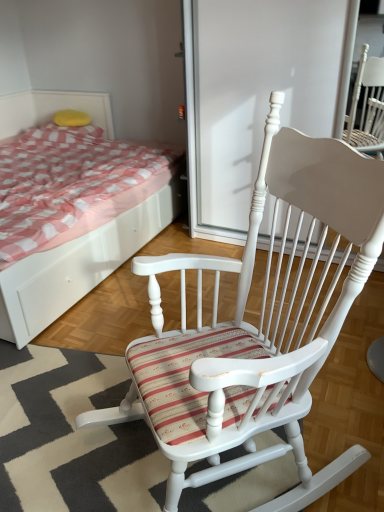
Question: Is white wood rocking chair at center shorter than white wood screen door at center?

Choices:
 (A) no
 (B) yes

Answer: (B)

Question: Does white wood rocking chair at center have a greater width compared to white wood screen door at center?

Choices:
 (A) yes
 (B) no

Answer: (A)

Question: Could you tell me if white wood rocking chair at center is facing white wood screen door at center?

Choices:
 (A) no
 (B) yes

Answer: (A)

Question: Is white wood rocking chair at center taller than white wood screen door at center?

Choices:
 (A) yes
 (B) no

Answer: (B)

Question: Is white wood rocking chair at center far from white wood screen door at center?

Choices:
 (A) yes
 (B) no

Answer: (A)

Question: Is white wood screen door at center completely or partially inside white wood rocking chair at center?

Choices:
 (A) no
 (B) yes

Answer: (A)

Question: Would you say white wood bed at upper left is a long distance from white wood screen door at center?

Choices:
 (A) no
 (B) yes

Answer: (A)

Question: From the image's perspective, does white wood bed at upper left appear lower than white wood screen door at center?

Choices:
 (A) yes
 (B) no

Answer: (A)

Question: Would you say white wood screen door at center is part of white wood bed at upper left's contents?

Choices:
 (A) yes
 (B) no

Answer: (B)

Question: From a real-world perspective, does white wood bed at upper left sit lower than white wood screen door at center?

Choices:
 (A) no
 (B) yes

Answer: (B)

Question: Is white wood bed at upper left positioned beyond the bounds of white wood screen door at center?

Choices:
 (A) yes
 (B) no

Answer: (A)

Question: From the image's perspective, is white wood bed at upper left above white wood screen door at center?

Choices:
 (A) yes
 (B) no

Answer: (B)

Question: Is yellow sponge at upper left oriented towards white wood screen door at center?

Choices:
 (A) no
 (B) yes

Answer: (A)